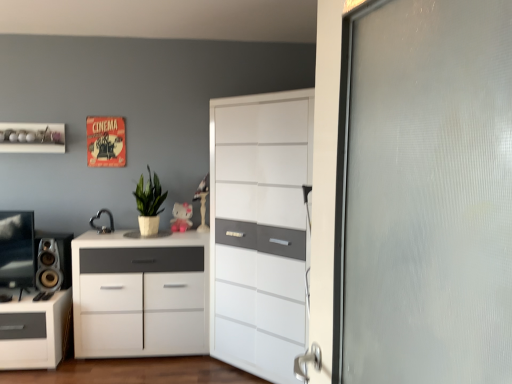
This screenshot has width=512, height=384. Identify the location of free space behind metallic heart-shaped object at center. (108, 225).